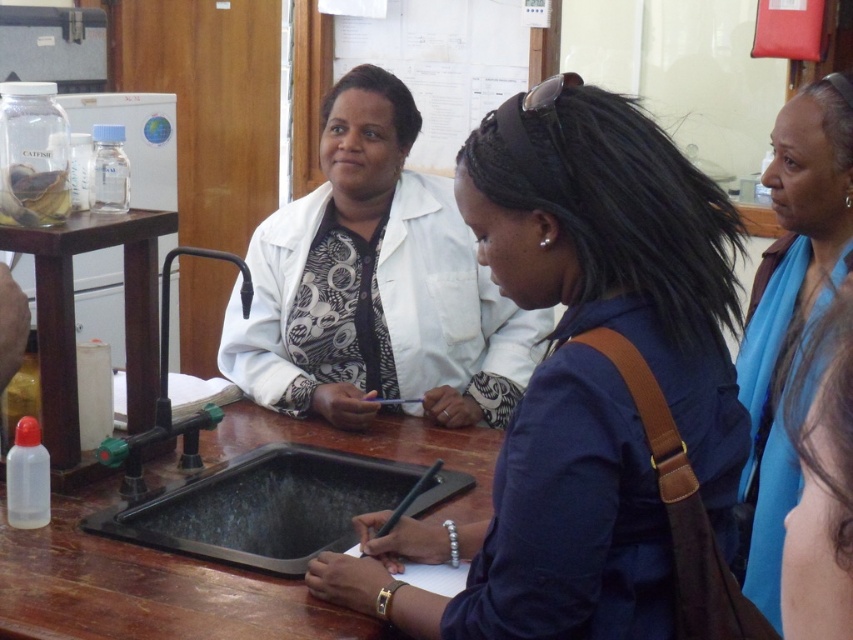
Question: Which object appears closest to the camera in this image?

Choices:
 (A) blue scarf at upper right
 (B) white paperboard at upper center
 (C) white lab coat at center

Answer: (A)

Question: Which point is farther from the camera taking this photo?

Choices:
 (A) (347, 353)
 (B) (39, 294)

Answer: (A)

Question: From the image, what is the correct spatial relationship of white paperboard at upper center in relation to transparent plastic bottle at left?

Choices:
 (A) left
 (B) right

Answer: (B)

Question: Is the position of white lab coat at center more distant than that of transparent plastic bottle at left?

Choices:
 (A) no
 (B) yes

Answer: (B)

Question: Can you confirm if blue scarf at upper right is wider than white paperboard at upper center?

Choices:
 (A) no
 (B) yes

Answer: (A)

Question: Which object appears farthest from the camera in this image?

Choices:
 (A) blue scarf at upper right
 (B) matte white lab coat at center
 (C) wooden table at center

Answer: (C)